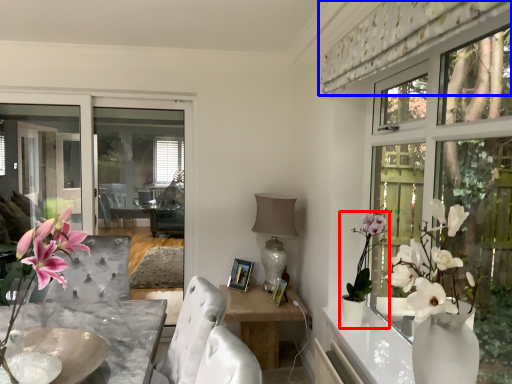
Question: Which of the following is the farthest to the observer, houseplant (highlighted by a red box) or curtain (highlighted by a blue box)?

Choices:
 (A) houseplant
 (B) curtain

Answer: (A)